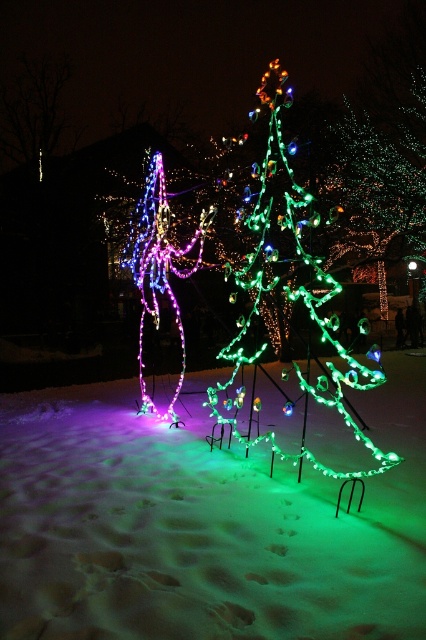
You are standing in the festive outdoor scene and want to place a small decoration between the two points marked as point [290,292] and point [166,216]. Which point is closer to you so you can start placing the decoration from there?

Point [290,292] is closer to you than point [166,216], so you should start placing the decoration from point [290,292] first.

You are planning to place a new decoration between the green illuminated tree at center and the illuminated plastic christmas tree at center. Based on their widths, which tree should you place it closer to for better visibility?

The green illuminated tree at center might be wider than the illuminated plastic christmas tree at center, so placing the decoration closer to the green illuminated tree at center would likely provide better visibility due to its potentially larger width.

You are standing in the festive outdoor scene and want to place a small gift box on the green frosted snow at lower center. Can you confirm if the snow area is large enough to fit the gift box without it touching the illuminated plastic christmas tree at center?

The green frosted snow at lower center has a lesser height compared to the illuminated plastic christmas tree at center, but the question is about the snow area being large enough to place the gift box. The description only mentions height difference, so we cannot determine the horizontal space available. Please check the horizontal space manually.